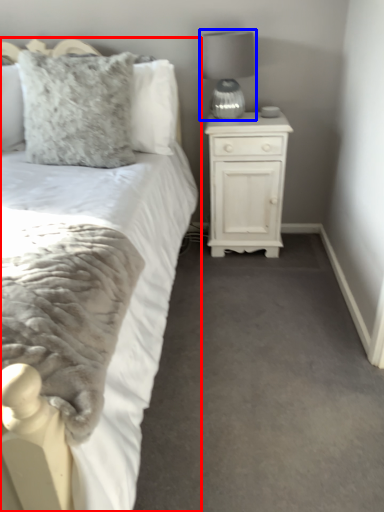
Question: Which point is closer to the camera, bed (highlighted by a red box) or lamp (highlighted by a blue box)?

Choices:
 (A) bed
 (B) lamp

Answer: (A)